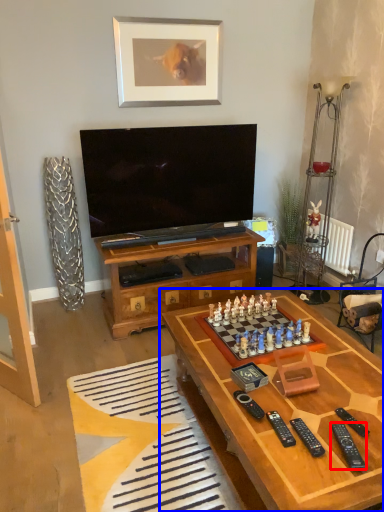
Question: Which object is further to the camera taking this photo, remote (highlighted by a red box) or table (highlighted by a blue box)?

Choices:
 (A) remote
 (B) table

Answer: (A)